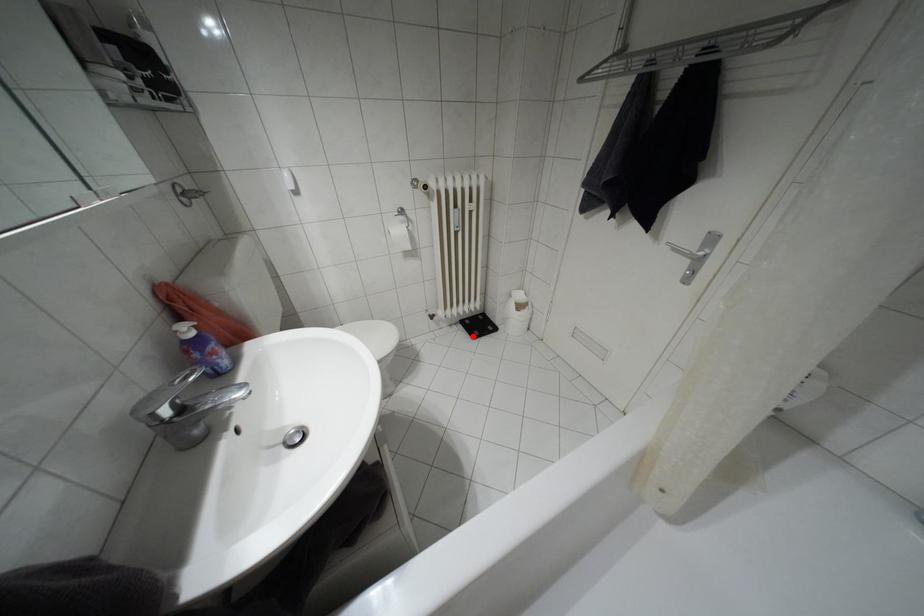
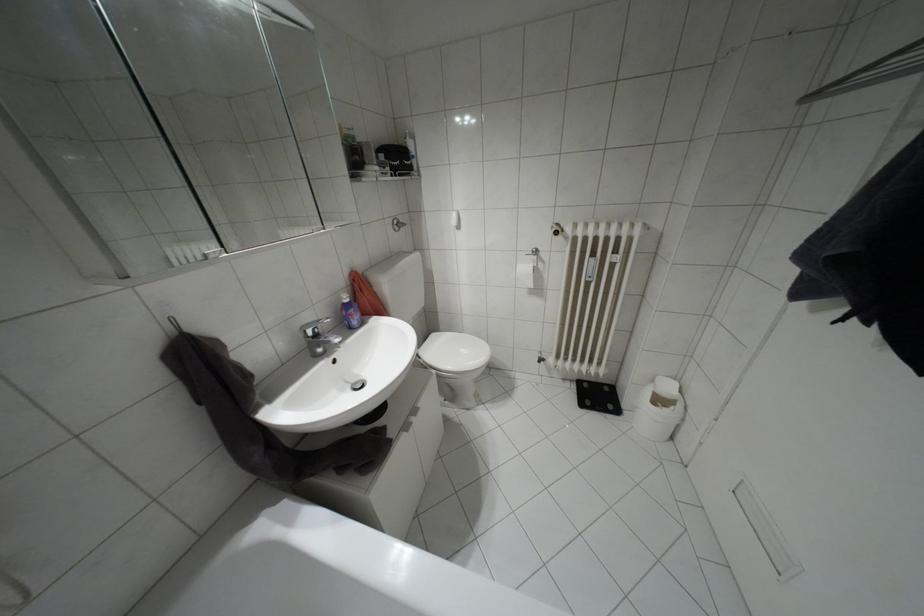
Question: I am providing you with two images of the same scene from different viewpoints. Image1 has a red point marked. In image2, the corresponding 3D location appears at what relative position? Reply with the corresponding letter.

Choices:
 (A) Closer
 (B) Farther

Answer: (B)